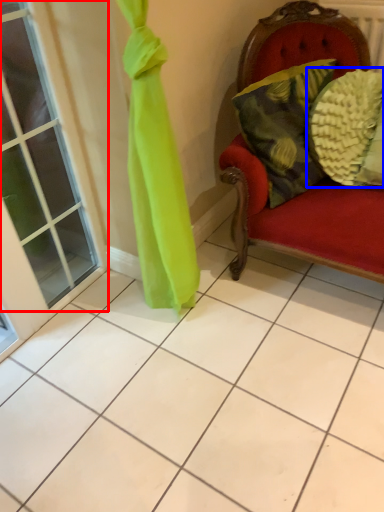
Question: Among these objects, which one is nearest to the camera, window (highlighted by a red box) or pillow (highlighted by a blue box)?

Choices:
 (A) window
 (B) pillow

Answer: (A)